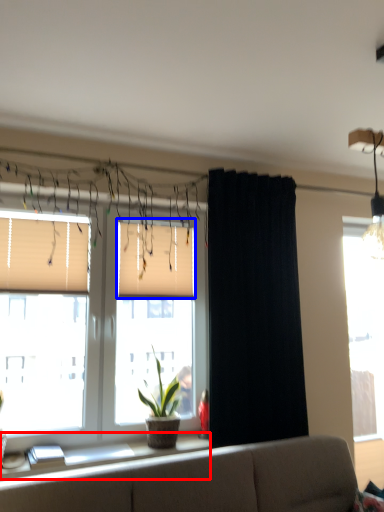
Question: Which point is closer to the camera, window sill (highlighted by a red box) or window blind (highlighted by a blue box)?

Choices:
 (A) window sill
 (B) window blind

Answer: (A)